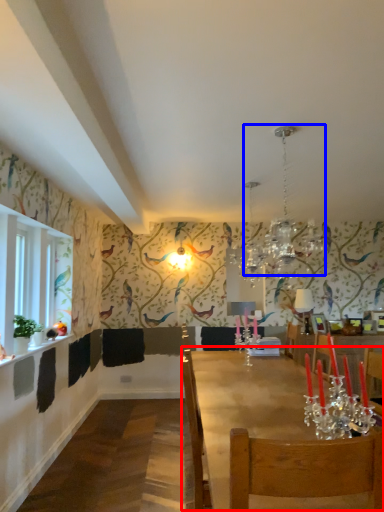
Question: Which object is closer to the camera taking this photo, table (highlighted by a red box) or light fixture (highlighted by a blue box)?

Choices:
 (A) table
 (B) light fixture

Answer: (A)